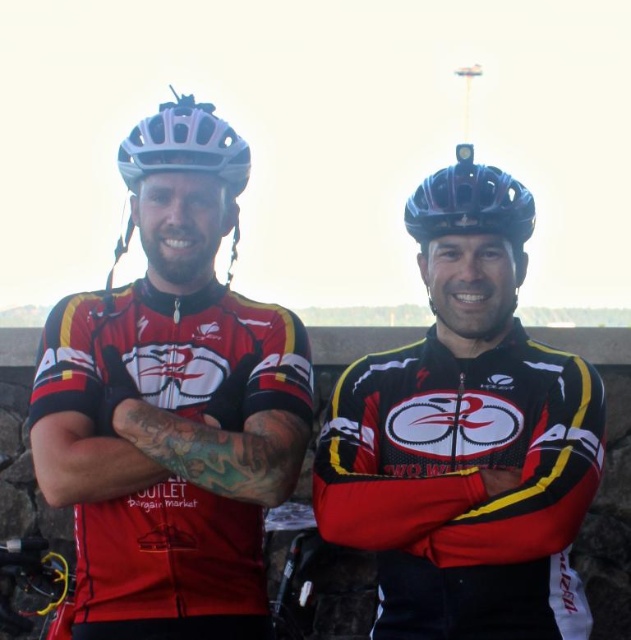
Question: Which is farther from the white matte bicycle helmet at upper left?

Choices:
 (A) shiny black helmet at upper center
 (B) white matte helmet at left

Answer: (A)

Question: Which point is farther to the camera?

Choices:
 (A) black matte helmet at center
 (B) white matte helmet at left
 (C) matte black cycling jersey at left
 (D) matte black cycling jersey at center

Answer: (A)

Question: From the image, what is the correct spatial relationship of matte black cycling jersey at left in relation to shiny black helmet at upper center?

Choices:
 (A) above
 (B) below

Answer: (B)

Question: Is shiny black helmet at upper center closer to the viewer compared to white matte bicycle helmet at upper left?

Choices:
 (A) yes
 (B) no

Answer: (B)

Question: Which point is farther to the camera?

Choices:
 (A) white matte bicycle helmet at upper left
 (B) white matte helmet at left
 (C) matte black cycling jersey at left
 (D) black matte helmet at center

Answer: (D)

Question: Can you confirm if matte black cycling jersey at left is wider than black matte helmet at center?

Choices:
 (A) no
 (B) yes

Answer: (B)